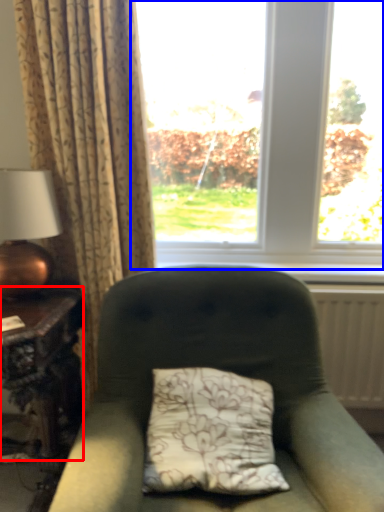
Question: Among these objects, which one is farthest to the camera, table (highlighted by a red box) or window (highlighted by a blue box)?

Choices:
 (A) table
 (B) window

Answer: (B)